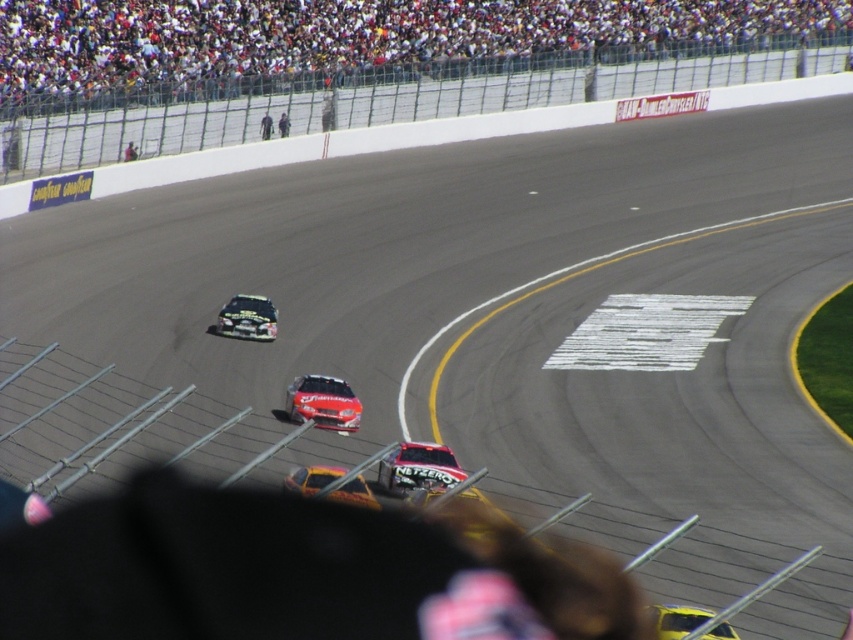
Is metallic silver racecar at center positioned at the back of yellow matte car at lower right?

Yes, metallic silver racecar at center is further from the viewer.

Can you confirm if metallic silver racecar at center is thinner than yellow matte car at lower right?

No, metallic silver racecar at center is not thinner than yellow matte car at lower right.

Is point (404, 490) more distant than point (726, 624)?

Yes.

You are a GUI agent. You are given a task and a screenshot of the screen. Output one action in this format:
    pyautogui.click(x=<x>, y=<y>)
    Task: Click on the metallic silver racecar at center
    The height and width of the screenshot is (640, 853).
    Given the screenshot: What is the action you would take?
    pyautogui.click(x=418, y=468)

Does white fabric crowd at upper center appear over shiny red car at center?

Indeed, white fabric crowd at upper center is positioned over shiny red car at center.

Can you confirm if white fabric crowd at upper center is shorter than shiny red car at center?

No, white fabric crowd at upper center is not shorter than shiny red car at center.

Which is behind, point (584, 16) or point (331, 397)?

The point (584, 16) is behind.

Locate an element on the screen. The width and height of the screenshot is (853, 640). white fabric crowd at upper center is located at coordinates (358, 40).

Is metallic silver racecar at center above shiny red car at center?

Incorrect, metallic silver racecar at center is not positioned above shiny red car at center.

Between metallic silver racecar at center and shiny red car at center, which one has less height?

With less height is metallic silver racecar at center.

Between point (436, 460) and point (334, 378), which one is positioned in front?

Point (436, 460) is in front.

I want to click on metallic silver racecar at center, so click(x=418, y=468).